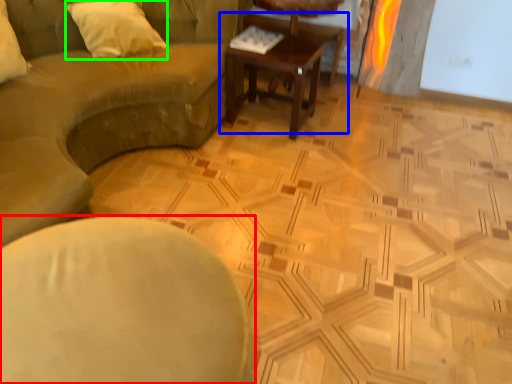
Question: Estimate the real-world distances between objects in this image. Which object is closer to chair (highlighted by a red box), coffee table (highlighted by a blue box) or pillow (highlighted by a green box)?

Choices:
 (A) coffee table
 (B) pillow

Answer: (B)